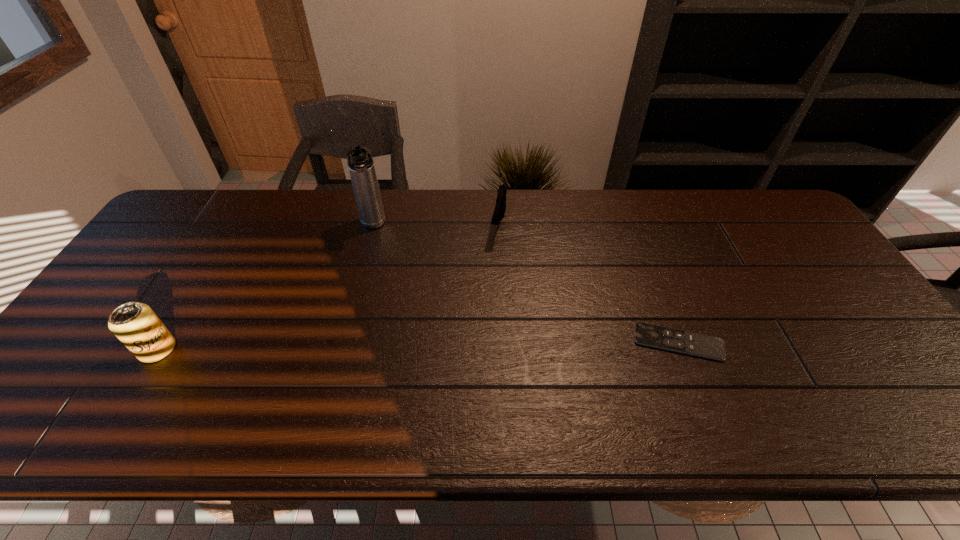
The image size is (960, 540). I want to click on empty location between the second object from right to left and the second tallest object, so click(x=327, y=287).

Find the location of a particular element. This screenshot has height=540, width=960. vacant area between the rightmost object and the thermos bottle is located at coordinates (525, 284).

The width and height of the screenshot is (960, 540). What are the coordinates of `free spot between the rightmost object and the second shortest object` in the screenshot? It's located at (588, 284).

Locate an element on the screen. The width and height of the screenshot is (960, 540). free space that is in between the beer can and the remote control is located at coordinates (418, 346).

Find the location of a particular element. The width and height of the screenshot is (960, 540). free point between the pistol and the rightmost object is located at coordinates (588, 284).

Where is `unoccupied area between the pistol and the rightmost object`? The height and width of the screenshot is (540, 960). unoccupied area between the pistol and the rightmost object is located at coordinates (588, 284).

Identify the location of vacant area between the second tallest object and the pistol. The image size is (960, 540). (327, 287).

Identify which object is the second nearest to the second object from right to left. Please provide its 2D coordinates. Your answer should be formatted as a tuple, i.e. [(x, y)], where the tuple contains the x and y coordinates of a point satisfying the conditions above.

[(710, 347)]

The width and height of the screenshot is (960, 540). Identify the location of object that is the third nearest to the remote control. (135, 324).

Locate an element on the screen. The height and width of the screenshot is (540, 960). free space that satisfies the following two spatial constraints: 1. on the back side of the beer can; 2. on the left side of the second object from right to left is located at coordinates (232, 225).